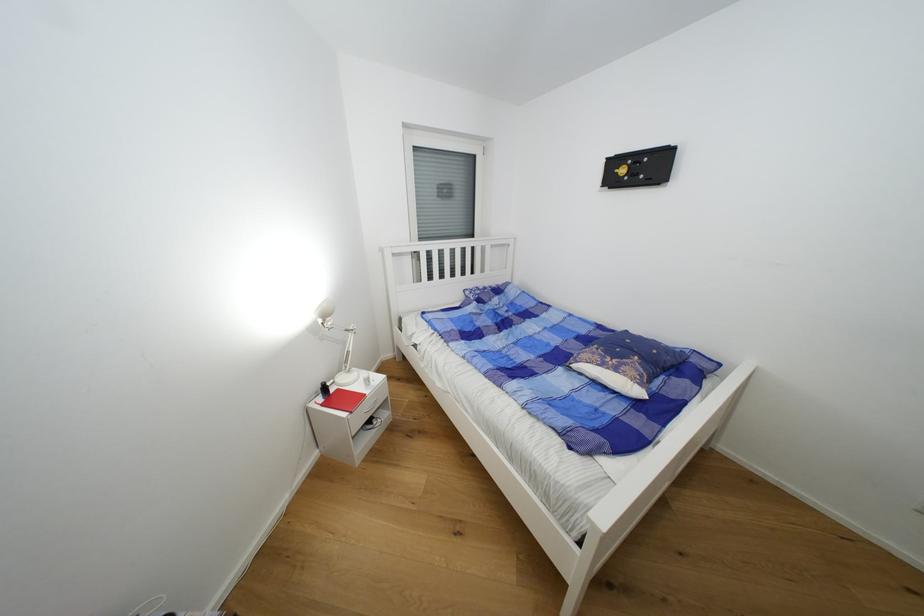
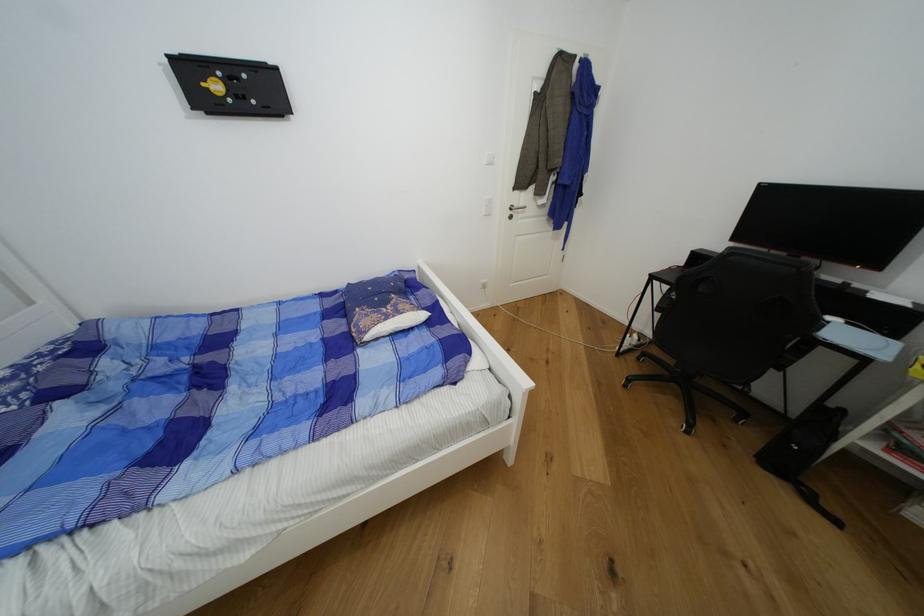
Where in the second image is the point corresponding to [622,371] from the first image?

(404, 314)